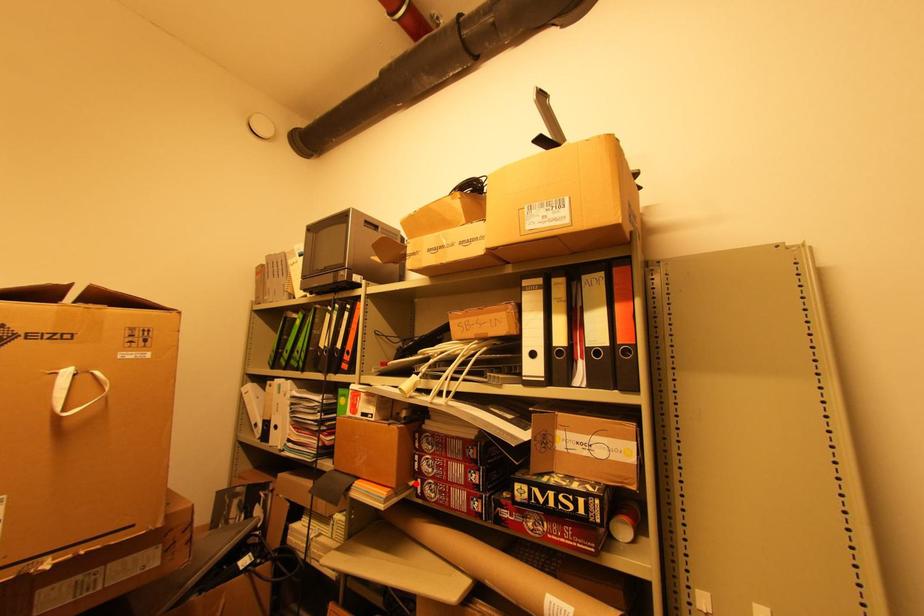
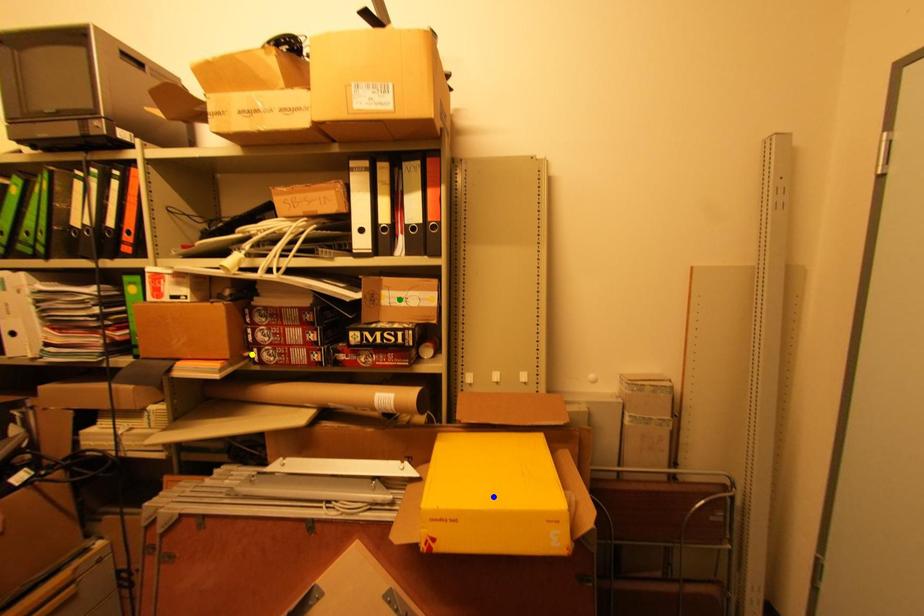
Question: I am providing you with two images of the same scene from different viewpoints. A red point is marked on the first image. You are given multiple points on the second image. Which point in image 2 represents the same 3d spot as the red point in image 1?

Choices:
 (A) green point
 (B) blue point
 (C) yellow point

Answer: (C)